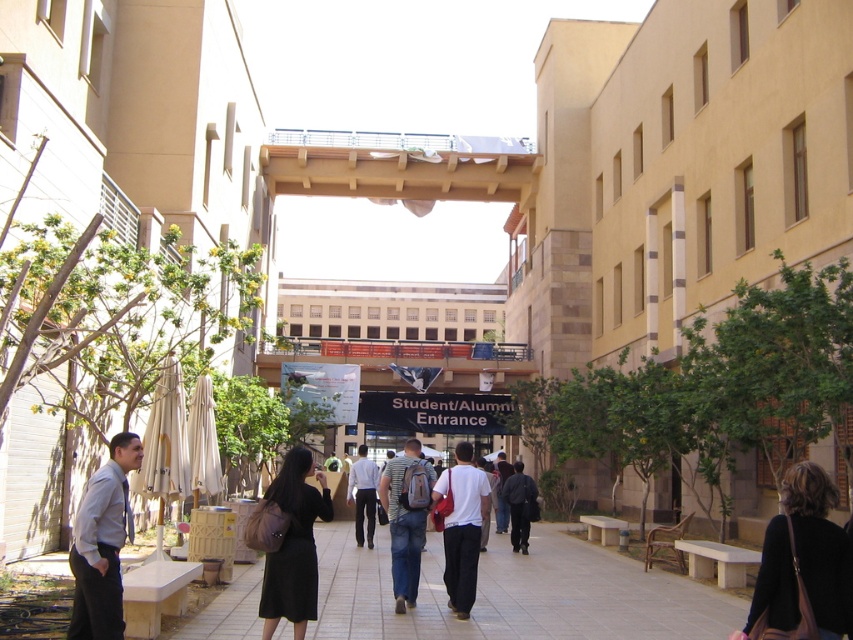
Question: Which object appears farthest from the camera in this image?

Choices:
 (A) light beige paving stone at center
 (B) light blue shirt at left

Answer: (A)

Question: Does white matte shirt at center come in front of white smooth shirt at center?

Choices:
 (A) yes
 (B) no

Answer: (A)

Question: Among these points, which one is nearest to the camera?

Choices:
 (A) (129, 449)
 (B) (281, 472)
 (C) (392, 460)
 (D) (822, 472)

Answer: (D)

Question: Observing the image, what is the correct spatial positioning of black leather jacket at lower right in reference to light blue shirt at left?

Choices:
 (A) below
 (B) above

Answer: (B)

Question: Which point is farther to the camera?

Choices:
 (A) black matte dress at center
 (B) white smooth shirt at center
 (C) striped cotton shirt at center

Answer: (B)

Question: Can you confirm if light beige paving stone at center is positioned to the right of white matte shirt at center?

Choices:
 (A) yes
 (B) no

Answer: (A)